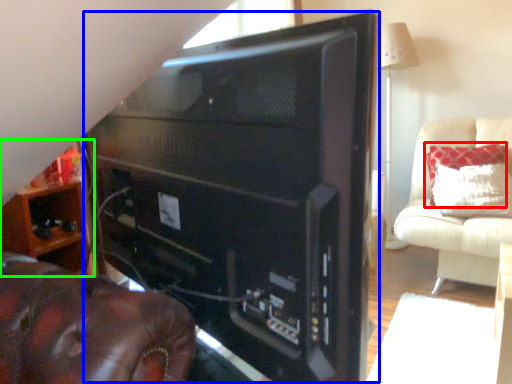
Question: Based on their relative distances, which object is farther from pillow (highlighted by a red box)? Choose from desktop computer (highlighted by a blue box) and furniture (highlighted by a green box).

Choices:
 (A) desktop computer
 (B) furniture

Answer: (B)